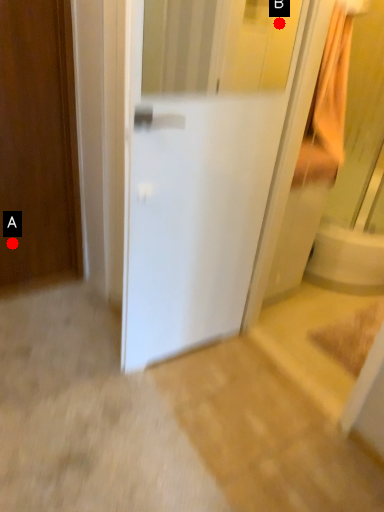
Question: Two points are circled on the image, labeled by A and B beside each circle. Which point is farther to the camera?

Choices:
 (A) A is further
 (B) B is further

Answer: (A)